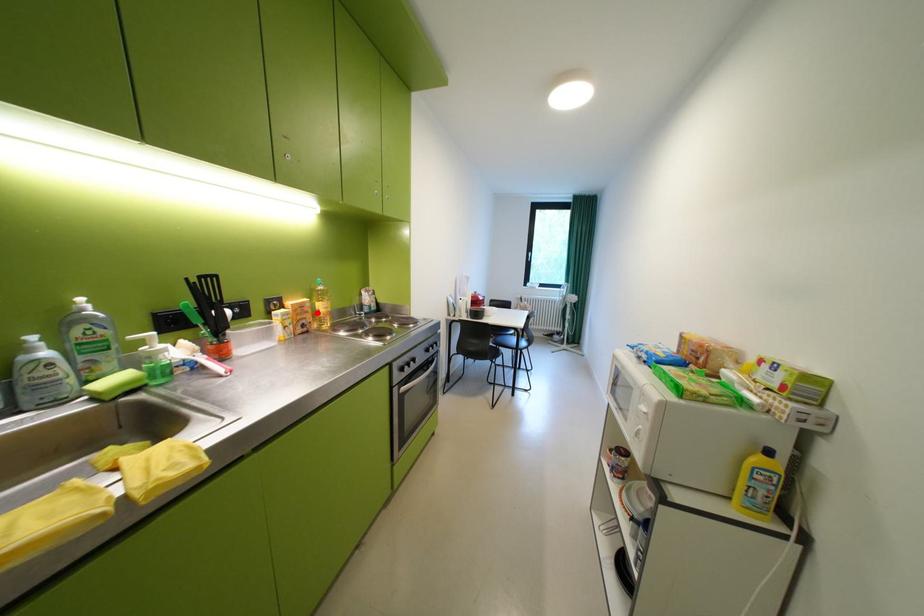
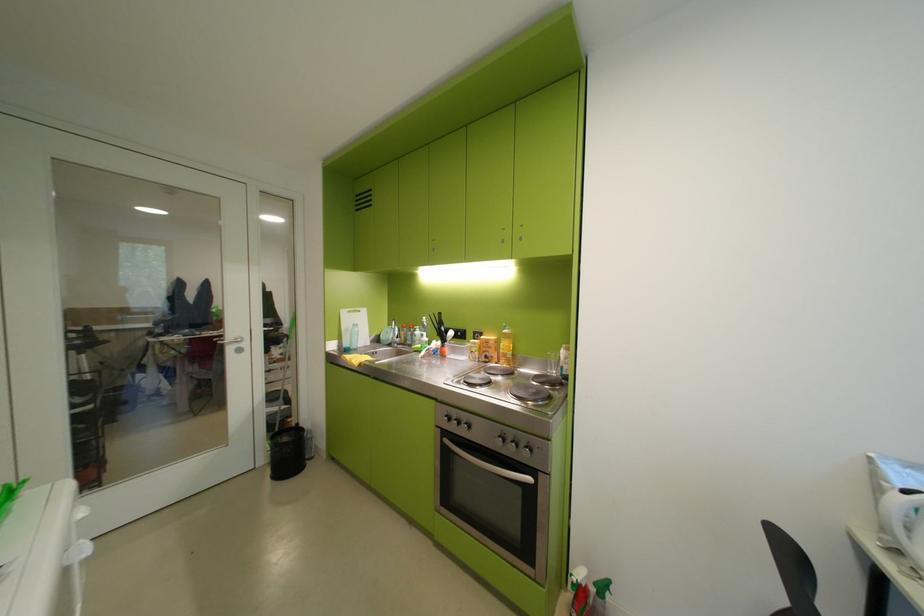
The point at the highlighted location is marked in the first image. Where is the corresponding point in the second image?

(501, 349)